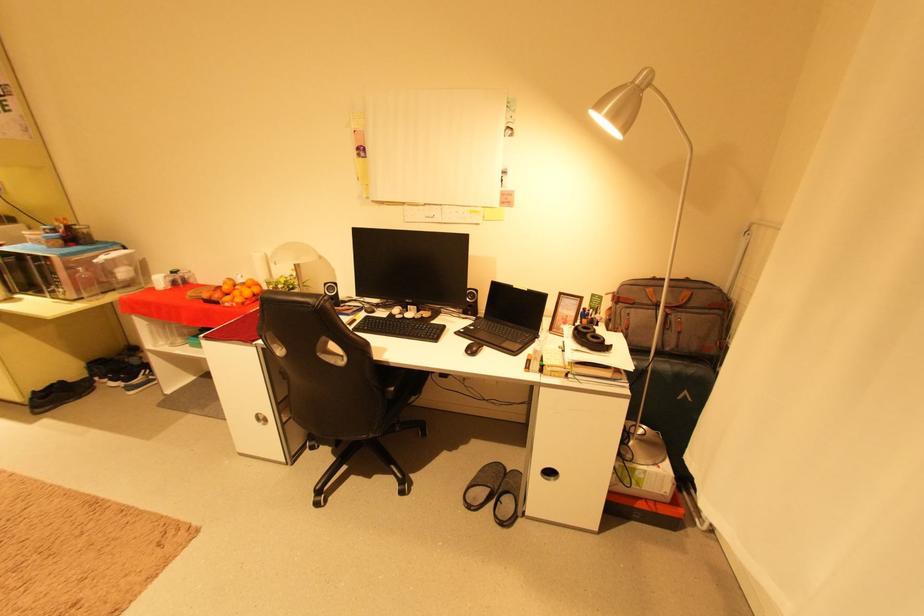
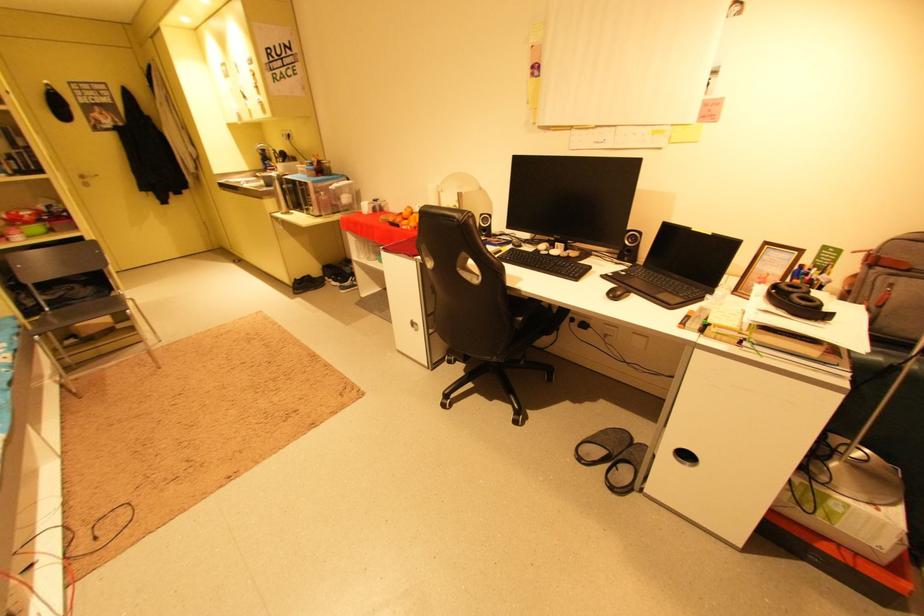
Locate, in the second image, the point that corresponds to pixel 477 298 in the first image.

(638, 241)